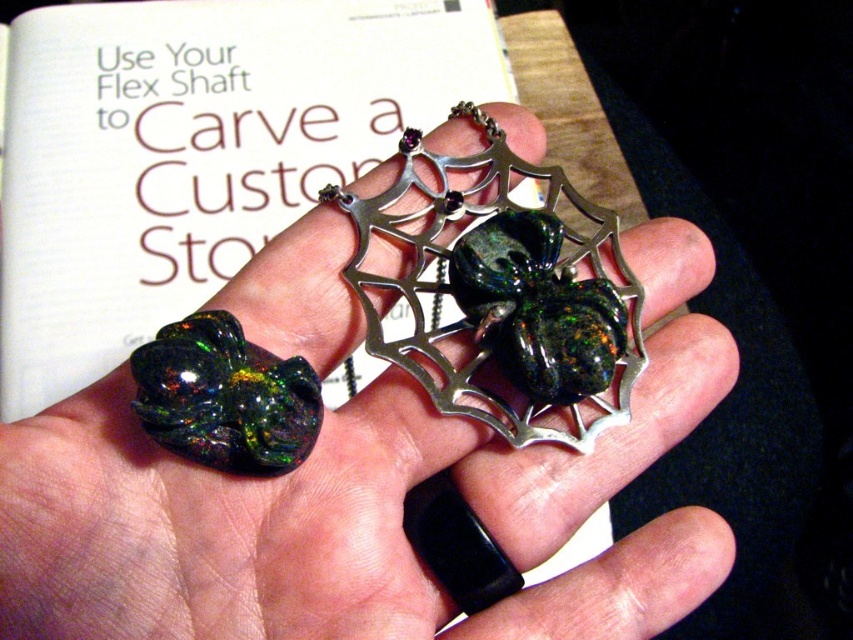
You are an appraiser examining a piece of jewelry. You notice two spiders on the pendant. Which one is more to the left? The shiny silver spider at center and the green opal spider at center are both part of the design. Can you determine their positions?

The shiny silver spider at center is positioned on the left side of green opal spider at center, so the shiny silver spider at center is more to the left.